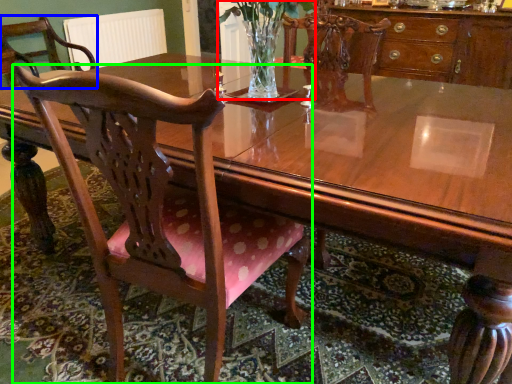
Question: Based on their relative distances, which object is nearer to floral arrangement (highlighted by a red box)? Choose from chair (highlighted by a blue box) and chair (highlighted by a green box).

Choices:
 (A) chair
 (B) chair

Answer: (B)